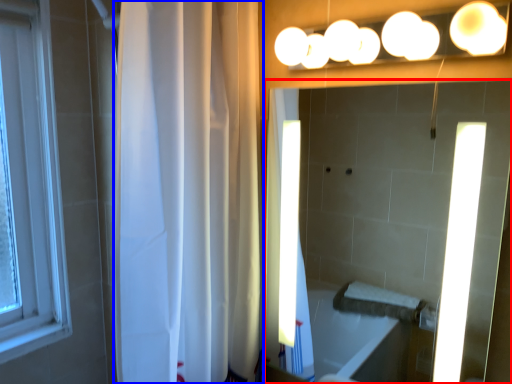
Question: Which point is closer to the camera, mirror (highlighted by a red box) or shower curtain (highlighted by a blue box)?

Choices:
 (A) mirror
 (B) shower curtain

Answer: (A)